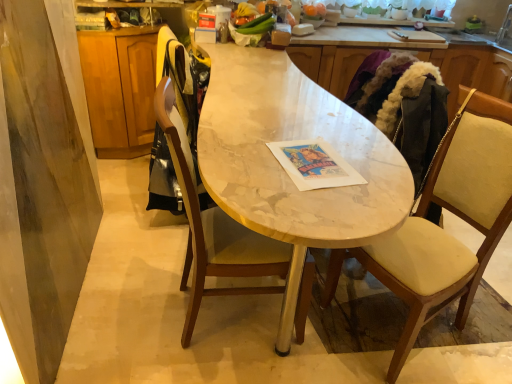
Identify the location of vacant space underneath beige fabric chair at right, the second chair from the left (from a real-world perspective). (400, 331).